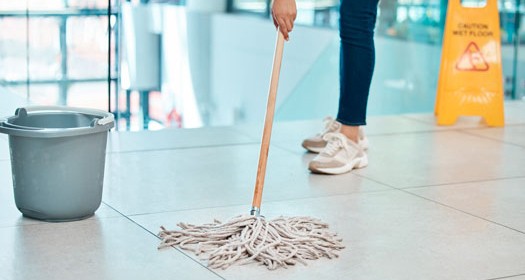
In order to click on large floor tile in this screenshot , I will do `click(92, 256)`, `click(104, 207)`, `click(157, 181)`, `click(178, 137)`, `click(387, 122)`, `click(514, 113)`, `click(512, 136)`, `click(464, 159)`, `click(485, 208)`, `click(421, 248)`.